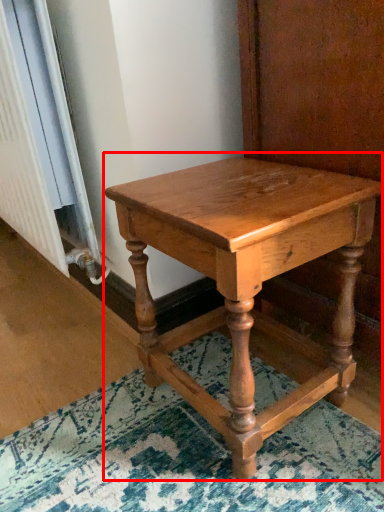
Question: From the image's perspective, considering the relative positions of table (annotated by the red box) and radiator in the image provided, where is table (annotated by the red box) located with respect to the staircase?

Choices:
 (A) below
 (B) above

Answer: (A)